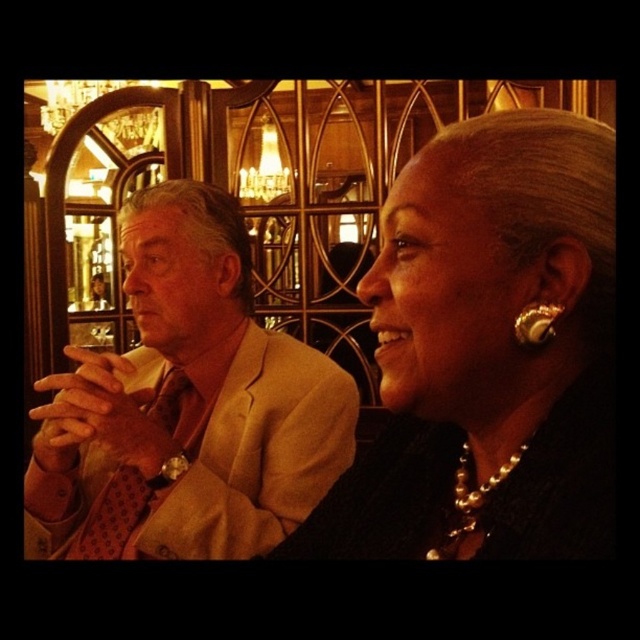
Is the position of pearl necklace at center more distant than that of beige textured suit at left?

No, pearl necklace at center is in front of beige textured suit at left.

Does pearl necklace at center have a lesser height compared to beige textured suit at left?

Correct, pearl necklace at center is not as tall as beige textured suit at left.

Is point (483, 120) in front of point (148, 241)?

That is True.

Image resolution: width=640 pixels, height=640 pixels. I want to click on pearl necklace at center, so click(488, 353).